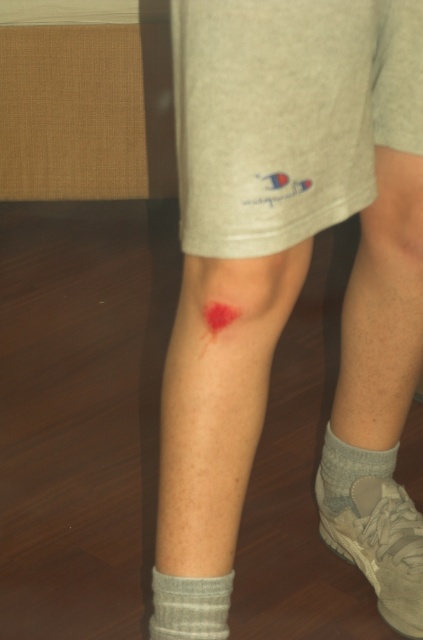
Which is below, gray ribbed sock at lower left or gray cotton sock at lower right?

gray ribbed sock at lower left is lower down.

Measure the distance between point (186, 579) and camera.

Point (186, 579) is 3.61 feet away from camera.

This screenshot has height=640, width=423. What are the coordinates of `gray ribbed sock at lower left` in the screenshot? It's located at (189, 605).

The image size is (423, 640). What do you see at coordinates (214, 428) in the screenshot?
I see `bright red scar at lower center` at bounding box center [214, 428].

Is point (227, 298) closer to camera compared to point (356, 458)?

That is True.

This screenshot has height=640, width=423. Identify the location of bright red scar at lower center. (214, 428).

Who is positioned more to the right, scarred skin at lower center or suede shoe at lower right?

Positioned to the right is suede shoe at lower right.

Who is more distant from viewer, [398,93] or [390,572]?

The point [390,572] is more distant.

Where is `scarred skin at lower center`? Image resolution: width=423 pixels, height=640 pixels. scarred skin at lower center is located at coordinates [285, 236].